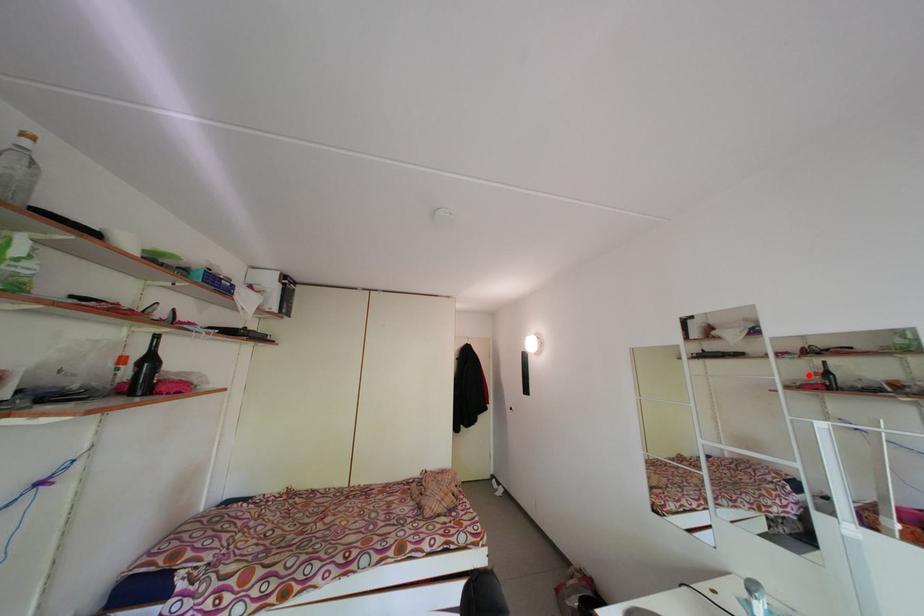
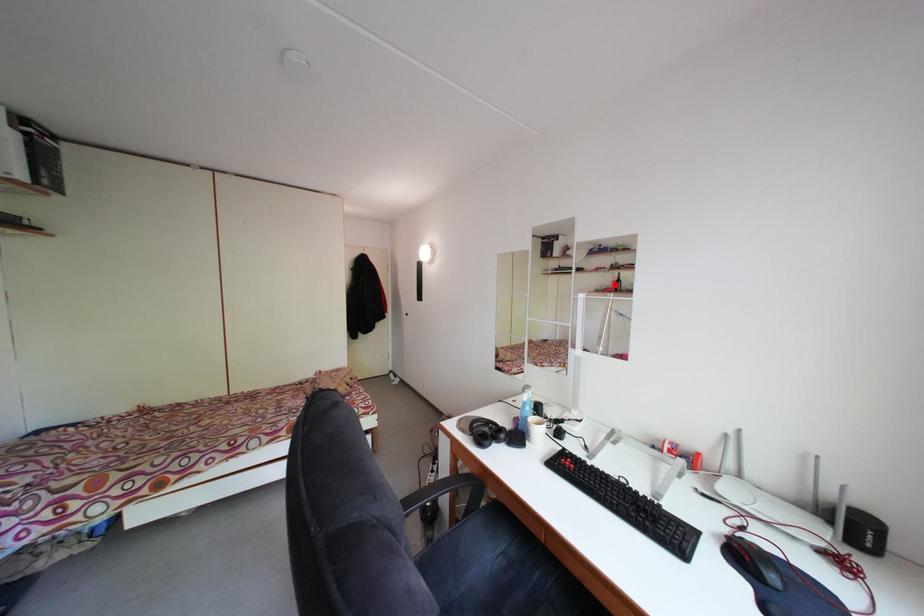
I am providing you with two images of the same scene from different viewpoints. A red point is marked on the first image and another point is marked on the second image. Is the marked point in image1 the same physical position as the marked point in image2?

Yes